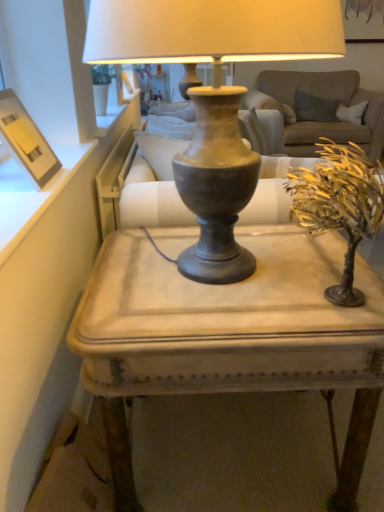
Find the location of a particular element. blank space situated above matte gray table at center (from a real-world perspective) is located at coordinates (234, 280).